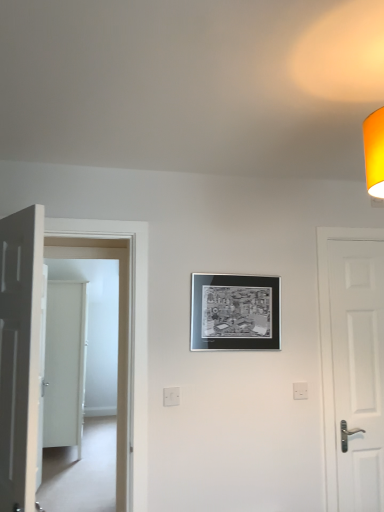
Question: Can white glossy door at left, the 2th door in the front-to-back sequence, be found inside white plastic electric outlet at center, positioned as the second electric outlet in back-to-front order?

Choices:
 (A) yes
 (B) no

Answer: (B)

Question: Does white plastic electric outlet at center, which is the 1th electric outlet from left to right, have a lesser height compared to white glossy door at left, the 2th door in the front-to-back sequence?

Choices:
 (A) no
 (B) yes

Answer: (B)

Question: Is white plastic electric outlet at center, the 2th electric outlet in the right-to-left sequence, oriented away from white glossy door at left, the 2th door when ordered from right to left?

Choices:
 (A) yes
 (B) no

Answer: (B)

Question: Is the surface of white plastic electric outlet at center, positioned as the second electric outlet in back-to-front order, in direct contact with white glossy door at left, which is the 3th door in back-to-front order?

Choices:
 (A) yes
 (B) no

Answer: (B)

Question: From a real-world perspective, is white plastic electric outlet at center, positioned as the second electric outlet in back-to-front order, below white glossy door at left, the 2th door when ordered from right to left?

Choices:
 (A) no
 (B) yes

Answer: (B)

Question: In the image, is white glossy door at left, positioned as the third door in left-to-right order, positioned in front of or behind white plastic electric outlet at lower center, the first electric outlet when ordered from right to left?

Choices:
 (A) front
 (B) behind

Answer: (A)

Question: Which is correct: white glossy door at left, the 2th door in the front-to-back sequence, is inside white plastic electric outlet at lower center, the first electric outlet when ordered from right to left, or outside of it?

Choices:
 (A) outside
 (B) inside

Answer: (A)

Question: Is point (139, 247) closer or farther from the camera than point (304, 390)?

Choices:
 (A) farther
 (B) closer

Answer: (B)

Question: Would you say white glossy door at left, positioned as the third door in left-to-right order, is to the left or to the right of white plastic electric outlet at lower center, the first electric outlet when ordered from right to left, in the picture?

Choices:
 (A) left
 (B) right

Answer: (A)

Question: Looking at the image, does white matte door at left, which is the first door from front to back, seem bigger or smaller compared to metallic silver picture frame at center?

Choices:
 (A) big
 (B) small

Answer: (A)

Question: In the image, is white matte door at left, placed as the second door when sorted from left to right, positioned in front of or behind metallic silver picture frame at center?

Choices:
 (A) front
 (B) behind

Answer: (A)

Question: Based on their positions, is white matte door at left, placed as the second door when sorted from left to right, located to the left or right of metallic silver picture frame at center?

Choices:
 (A) right
 (B) left

Answer: (B)

Question: Considering the positions of white matte door at left, which is the first door from front to back, and metallic silver picture frame at center in the image, is white matte door at left, which is the first door from front to back, taller or shorter than metallic silver picture frame at center?

Choices:
 (A) short
 (B) tall

Answer: (B)

Question: From the image's perspective, relative to white glossy door at left, the 2th door when ordered from right to left, is white plastic electric outlet at lower center, the first electric outlet when ordered from right to left, above or below?

Choices:
 (A) above
 (B) below

Answer: (B)

Question: Is white plastic electric outlet at lower center, the 2th electric outlet viewed from the front, wider or thinner than white glossy door at left, the 2th door when ordered from right to left?

Choices:
 (A) wide
 (B) thin

Answer: (B)